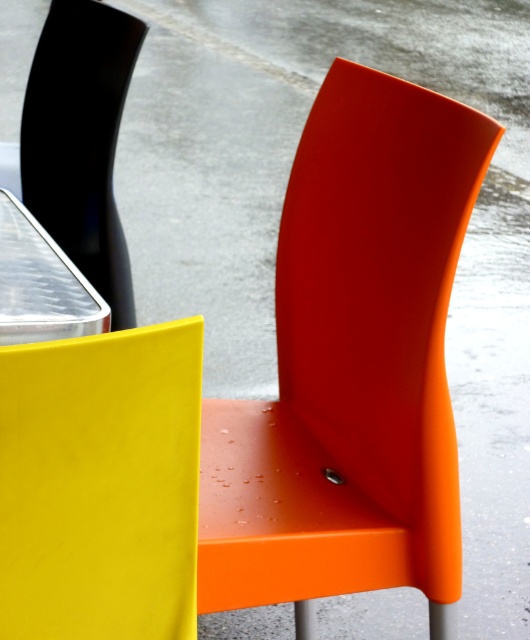
Does orange matte chair at center have a greater width compared to matte black chair at left?

Yes, orange matte chair at center is wider than matte black chair at left.

Is orange matte chair at center shorter than matte black chair at left?

No, orange matte chair at center is not shorter than matte black chair at left.

Where is `orange matte chair at center`? The height and width of the screenshot is (640, 530). orange matte chair at center is located at coordinates (351, 364).

Does orange matte chair at center lie behind matte yellow chair at left?

Yes, orange matte chair at center is further from the viewer.

Can you confirm if orange matte chair at center is shorter than matte yellow chair at left?

No.

Measure the distance between point (359, 97) and camera.

Point (359, 97) and camera are 3.46 feet apart.

Locate an element on the screen. orange matte chair at center is located at coordinates (351, 364).

Between point (171, 502) and point (113, 128), which one is positioned behind?

Point (113, 128)

Is matte yellow chair at left wider than matte black chair at left?

No, matte yellow chair at left is not wider than matte black chair at left.

Identify the location of matte yellow chair at left. The width and height of the screenshot is (530, 640). [101, 484].

At what (x,y) coordinates should I click in order to perform the action: click on matte yellow chair at left. Please return your answer as a coordinate pair (x, y). The image size is (530, 640). Looking at the image, I should click on (101, 484).